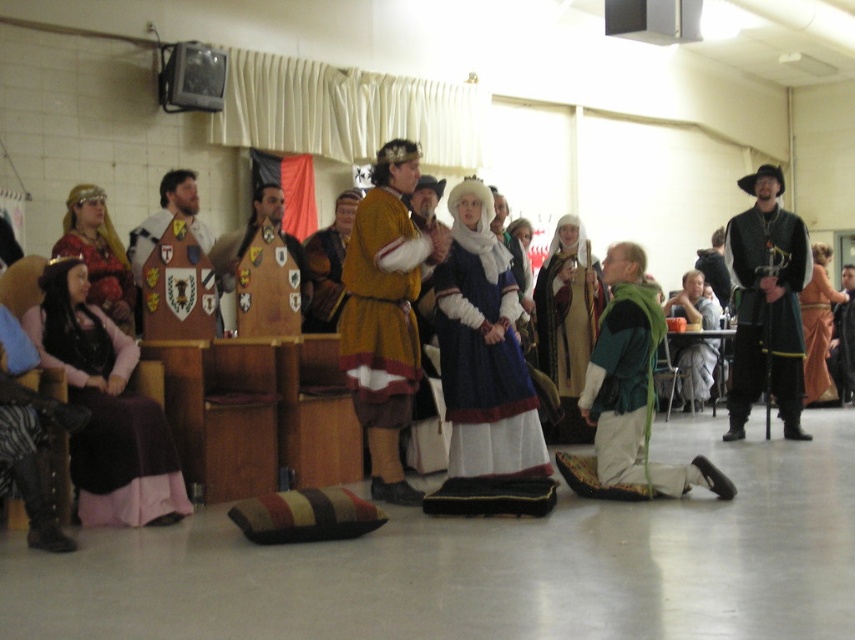
Between matte gold crown at center and matte gold armor at center, which one is positioned lower?

Positioned lower is matte gold crown at center.

Between matte gold crown at center and matte gold armor at center, which one appears on the left side from the viewer's perspective?

matte gold crown at center is more to the left.

You are a GUI agent. You are given a task and a screenshot of the screen. Output one action in this format:
    pyautogui.click(x=<x>, y=<y>)
    Task: Click on the matte gold crown at center
    
    Given the screenshot: What is the action you would take?
    pyautogui.click(x=258, y=412)

Is wooden shield at center further to the viewer compared to orange velvet dress at lower right?

That is False.

Does wooden shield at center have a smaller size compared to orange velvet dress at lower right?

Yes.

Is point (169, 186) closer to viewer compared to point (818, 273)?

Yes, it is.

You are a GUI agent. You are given a task and a screenshot of the screen. Output one action in this format:
    pyautogui.click(x=<x>, y=<y>)
    Task: Click on the wooden shield at center
    The height and width of the screenshot is (640, 855).
    Given the screenshot: What is the action you would take?
    pyautogui.click(x=167, y=220)

Who is shorter, blue velvet dress at center or matte gold armor at center?

blue velvet dress at center is shorter.

Can you confirm if blue velvet dress at center is wider than matte gold armor at center?

Correct, the width of blue velvet dress at center exceeds that of matte gold armor at center.

Image resolution: width=855 pixels, height=640 pixels. Identify the location of blue velvet dress at center. (482, 349).